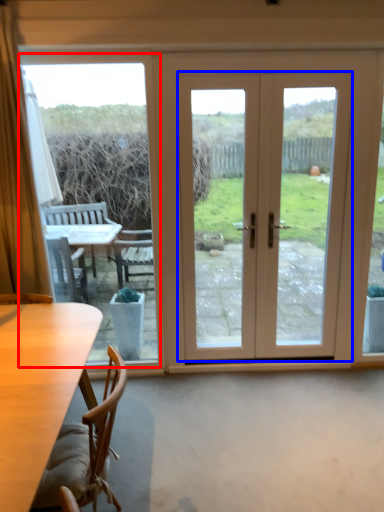
Question: Among these objects, which one is farthest to the camera, window screen (highlighted by a red box) or door (highlighted by a blue box)?

Choices:
 (A) window screen
 (B) door

Answer: (B)